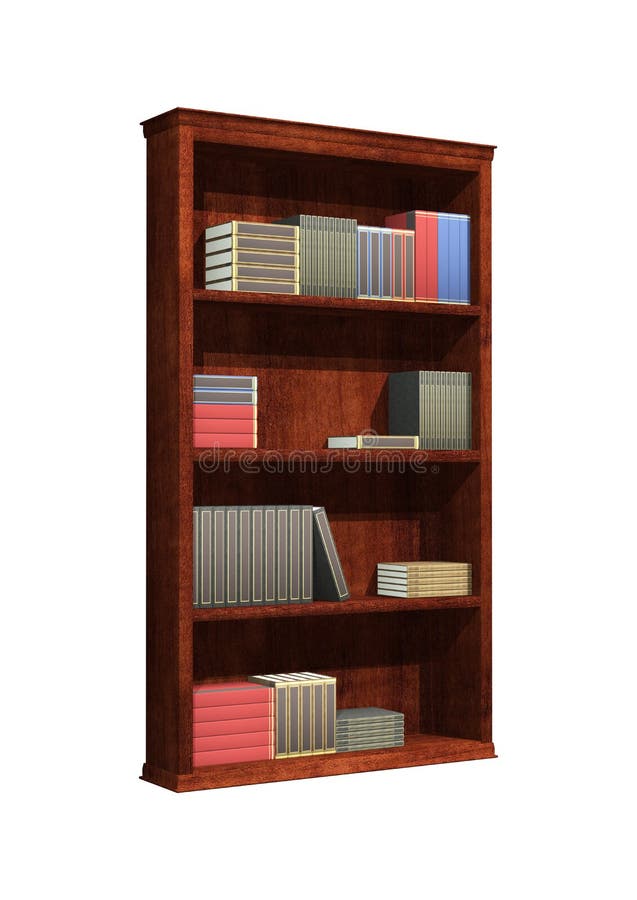
At what (x,y) coordinates should I click in order to perform the action: click on bookshelves. Please return your answer as a coordinate pair (x, y). The width and height of the screenshot is (637, 900). Looking at the image, I should click on pyautogui.click(x=427, y=741), pyautogui.click(x=368, y=604), pyautogui.click(x=331, y=453), pyautogui.click(x=304, y=294).